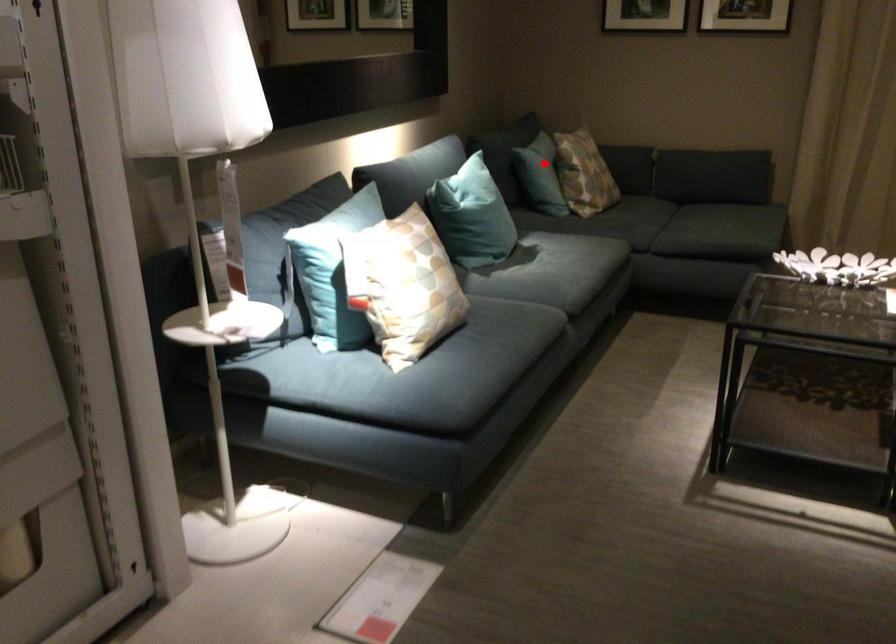
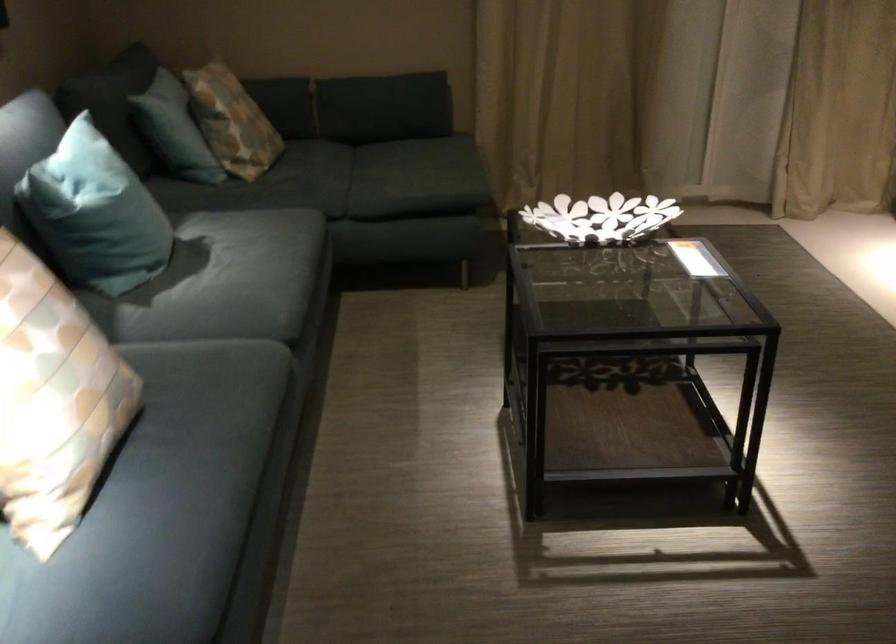
Question: I am providing you with two images of the same scene from different viewpoints. Image1 has a red point marked. In image2, the corresponding 3D location appears at what relative position? Reply with the corresponding letter.

Choices:
 (A) Closer
 (B) Farther

Answer: (A)